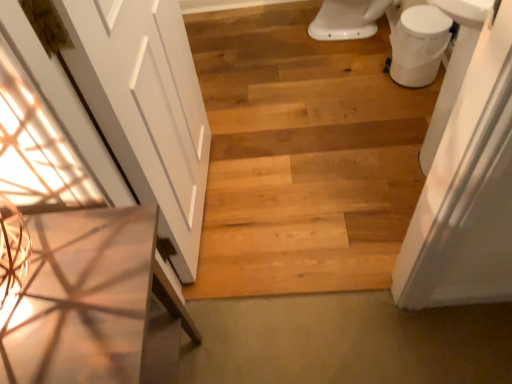
The width and height of the screenshot is (512, 384). In order to click on vacant space behind natural wood plank at center in this screenshot , I will do `click(290, 218)`.